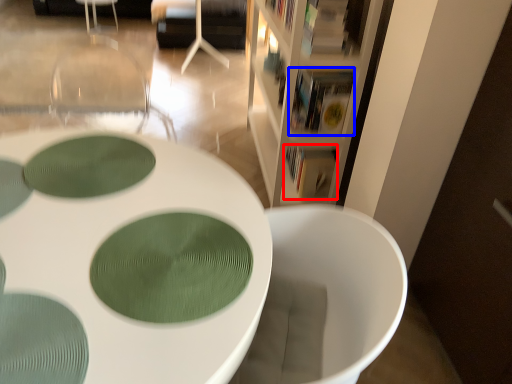
Question: Which object is closer to the camera taking this photo, book (highlighted by a red box) or book (highlighted by a blue box)?

Choices:
 (A) book
 (B) book

Answer: (B)